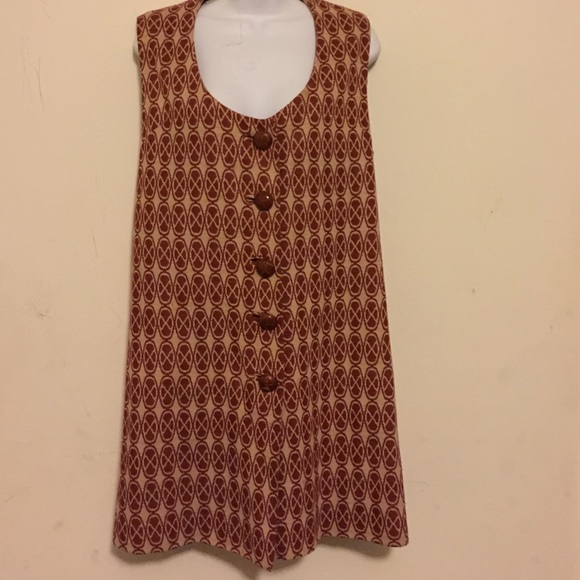
Identify the location of tan background wall. (470, 296).